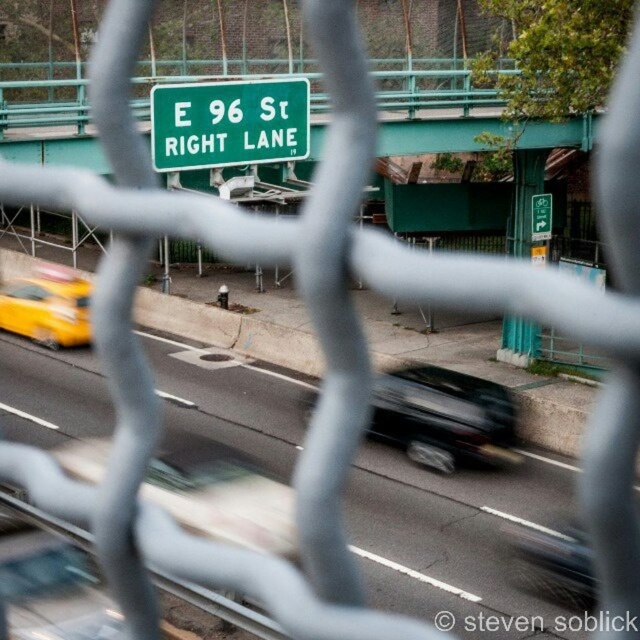
Is shiny black sedan at center wider than green plastic parking sign at upper center?

Yes, shiny black sedan at center is wider than green plastic parking sign at upper center.

From the picture: Does shiny black sedan at center appear on the left side of green plastic parking sign at upper center?

Indeed, shiny black sedan at center is positioned on the left side of green plastic parking sign at upper center.

This screenshot has height=640, width=640. I want to click on shiny black sedan at center, so click(x=444, y=417).

Can you confirm if black rubber car at right lane is positioned below shiny black sedan at center?

Yes, black rubber car at right lane is below shiny black sedan at center.

Who is higher up, black rubber car at right lane or shiny black sedan at center?

shiny black sedan at center

Image resolution: width=640 pixels, height=640 pixels. I want to click on black rubber car at right lane, so click(452, 532).

Locate an element on the screen. This screenshot has width=640, height=640. black rubber car at right lane is located at coordinates (452, 532).

Can you confirm if shiny black sedan at center is positioned above yellow rubber taxi at left?

No.

Does shiny black sedan at center have a larger size compared to yellow rubber taxi at left?

Yes, shiny black sedan at center is bigger than yellow rubber taxi at left.

Find the location of a particular element. This screenshot has width=640, height=640. shiny black sedan at center is located at coordinates (444, 417).